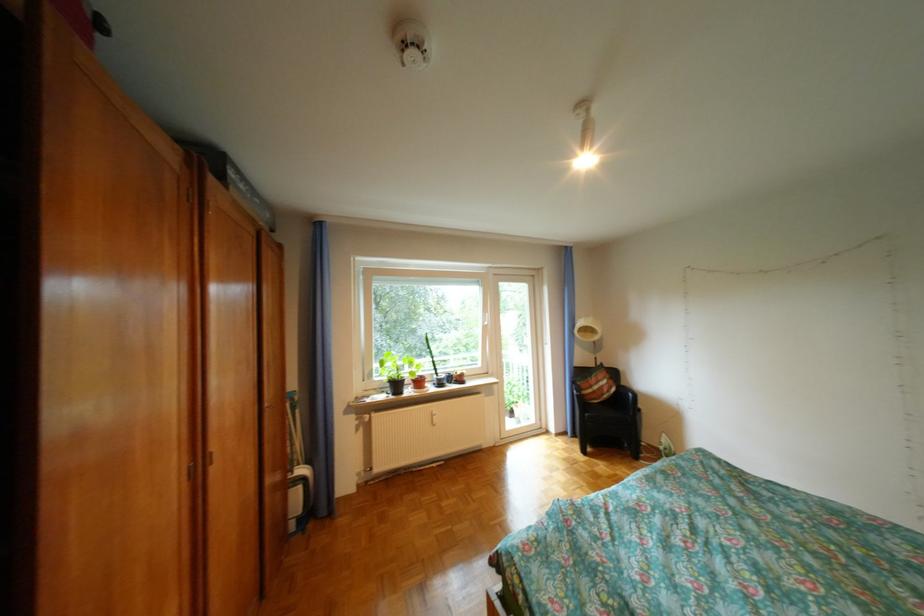
This screenshot has width=924, height=616. In order to click on wardrobe door handle in this screenshot , I will do `click(209, 456)`.